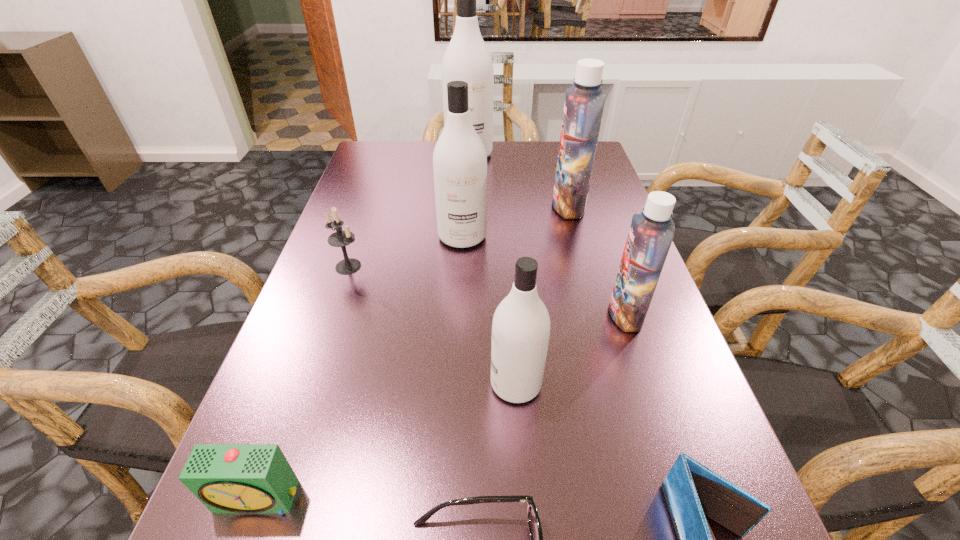
You are a GUI agent. You are given a task and a screenshot of the screen. Output one action in this format:
    pyautogui.click(x=<x>, y=<y>)
    Task: Click on the free spot between the nearest white shampoo and the farthest white shampoo
    The height and width of the screenshot is (540, 960).
    Given the screenshot: What is the action you would take?
    pyautogui.click(x=492, y=269)

Where is `vacant point located between the green alarm clock and the bigger blue shampoo`? vacant point located between the green alarm clock and the bigger blue shampoo is located at coordinates (414, 352).

I want to click on unoccupied area between the alarm clock and the second nearest shampoo, so click(442, 406).

Find the location of a particular element. This screenshot has height=540, width=960. vacant region between the tallest object and the alarm clock is located at coordinates (364, 326).

Identify which object is located as the eighth nearest to the sixth tallest object. Please provide its 2D coordinates. Your answer should be formatted as a tuple, i.e. [(x, y)], where the tuple contains the x and y coordinates of a point satisfying the conditions above.

[(692, 490)]

You are a GUI agent. You are given a task and a screenshot of the screen. Output one action in this format:
    pyautogui.click(x=<x>, y=<y>)
    Task: Click on the object that is the second closest to the biggest white shampoo
    
    Given the screenshot: What is the action you would take?
    pyautogui.click(x=459, y=159)

Locate which shampoo ranks in proximity to the farther blue shampoo. Please provide its 2D coordinates. Your answer should be formatted as a tuple, i.e. [(x, y)], where the tuple contains the x and y coordinates of a point satisfying the conditions above.

[(459, 159)]

Identify the location of shampoo that can be found as the second closest to the second smallest white shampoo. The width and height of the screenshot is (960, 540). (651, 233).

Where is `the closest white shampoo to the bigger blue shampoo`? the closest white shampoo to the bigger blue shampoo is located at coordinates (459, 159).

I want to click on the closest white shampoo relative to the second shortest object, so click(x=520, y=333).